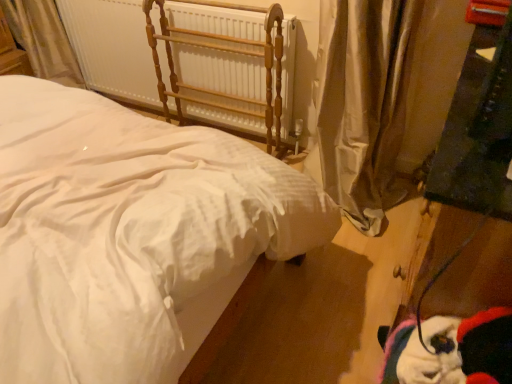
Question: Is white cotton bed at center to the left of silky beige curtain at right from the viewer's perspective?

Choices:
 (A) no
 (B) yes

Answer: (B)

Question: Is the depth of white cotton bed at center greater than that of silky beige curtain at right?

Choices:
 (A) no
 (B) yes

Answer: (A)

Question: Is white cotton bed at center to the right of silky beige curtain at right from the viewer's perspective?

Choices:
 (A) yes
 (B) no

Answer: (B)

Question: Is white cotton bed at center in front of silky beige curtain at right?

Choices:
 (A) yes
 (B) no

Answer: (A)

Question: Is white cotton bed at center oriented towards silky beige curtain at right?

Choices:
 (A) no
 (B) yes

Answer: (A)

Question: Is silky beige curtain at right at the back of white cotton bed at center?

Choices:
 (A) no
 (B) yes

Answer: (A)

Question: Considering the relative positions of white painted metal radiator at upper center and silky beige curtain at right in the image provided, is white painted metal radiator at upper center to the right of silky beige curtain at right from the viewer's perspective?

Choices:
 (A) yes
 (B) no

Answer: (B)

Question: Is white painted metal radiator at upper center oriented towards silky beige curtain at right?

Choices:
 (A) yes
 (B) no

Answer: (B)

Question: Is white painted metal radiator at upper center touching silky beige curtain at right?

Choices:
 (A) no
 (B) yes

Answer: (A)

Question: From the image's perspective, is white painted metal radiator at upper center below silky beige curtain at right?

Choices:
 (A) yes
 (B) no

Answer: (B)

Question: From the image's perspective, is white painted metal radiator at upper center above silky beige curtain at right?

Choices:
 (A) yes
 (B) no

Answer: (A)

Question: Is white painted metal radiator at upper center wider than silky beige curtain at right?

Choices:
 (A) yes
 (B) no

Answer: (B)

Question: Is silky beige curtain at right not close to white cotton bed at center?

Choices:
 (A) yes
 (B) no

Answer: (B)